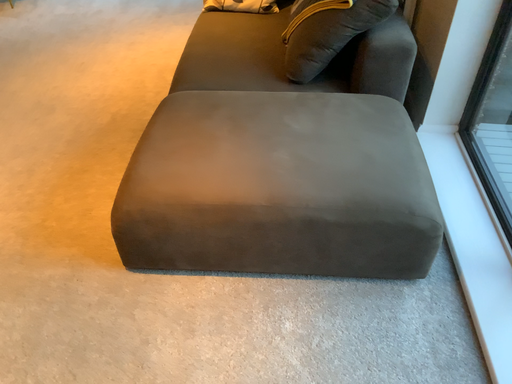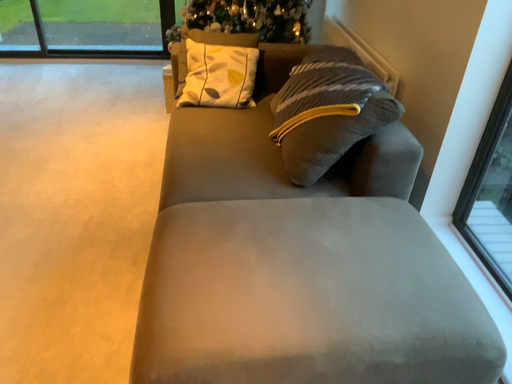
Question: Which way did the camera rotate in the video?

Choices:
 (A) rotated right
 (B) rotated left

Answer: (A)